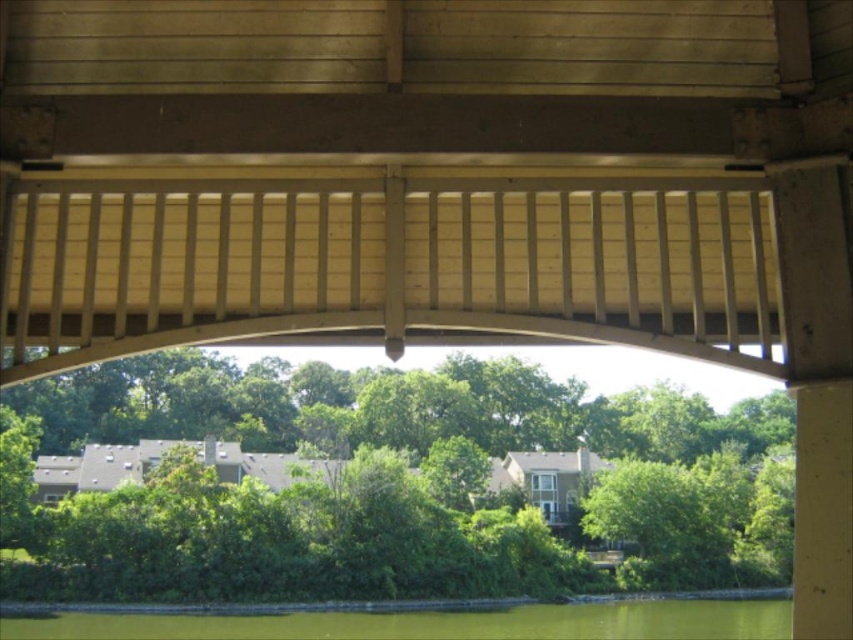
You are standing under the wooden bridge and want to reach the point at coordinates point (x=526, y=93). If your maximum reach is 7 meters, can you touch it without moving closer?

The point (x=526, y=93) is 7.29 meters away from the viewer, which exceeds your maximum reach of 7 meters. Therefore, you cannot touch it without moving closer.

You are standing under the wooden bridge at center and want to cross to the residential area seen through the archway. Since the green water at lower center is in your path, will you need to step over it?

The wooden bridge at center is smaller than the green water at lower center, so the water is wider. Therefore, you would need to step over the green water at lower center to reach the residential area.